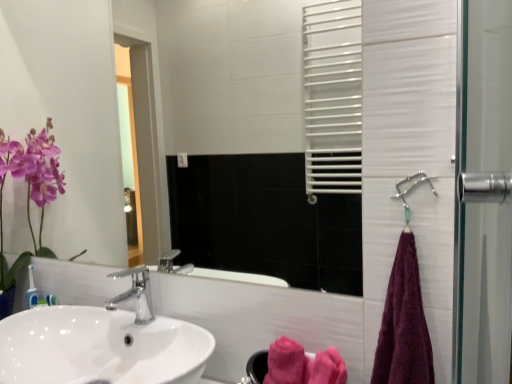
Question: From a real-world perspective, is pink fluffy bath towel at lower center, positioned as the second bath towel in right-to-left order, physically above metallic silver shower at right?

Choices:
 (A) no
 (B) yes

Answer: (A)

Question: From a real-world perspective, is pink fluffy bath towel at lower center, the 1th bath towel when ordered from back to front, beneath metallic silver shower at right?

Choices:
 (A) yes
 (B) no

Answer: (A)

Question: Would you consider pink fluffy bath towel at lower center, the 1th bath towel when ordered from back to front, to be distant from metallic silver shower at right?

Choices:
 (A) no
 (B) yes

Answer: (A)

Question: Is pink fluffy bath towel at lower center, positioned as the 2th bath towel in front-to-back order, turned away from metallic silver shower at right?

Choices:
 (A) no
 (B) yes

Answer: (A)

Question: Is pink fluffy bath towel at lower center, which is the first bath towel in left-to-right order, outside of metallic silver shower at right?

Choices:
 (A) no
 (B) yes

Answer: (B)

Question: Does pink fluffy bath towel at lower center, which is the first bath towel in left-to-right order, have a smaller size compared to metallic silver shower at right?

Choices:
 (A) no
 (B) yes

Answer: (A)

Question: Does polished chrome faucet at center have a greater width compared to purple cotton towel at right, placed as the 1th bath towel when sorted from front to back?

Choices:
 (A) no
 (B) yes

Answer: (B)

Question: Is the surface of polished chrome faucet at center in direct contact with purple cotton towel at right, which appears as the first bath towel when viewed from the right?

Choices:
 (A) no
 (B) yes

Answer: (A)

Question: From the image's perspective, is polished chrome faucet at center below purple cotton towel at right, placed as the 1th bath towel when sorted from front to back?

Choices:
 (A) yes
 (B) no

Answer: (A)

Question: Is polished chrome faucet at center closer to the viewer compared to purple cotton towel at right, which is counted as the second bath towel, starting from the left?

Choices:
 (A) no
 (B) yes

Answer: (A)

Question: Is purple cotton towel at right, which appears as the first bath towel when viewed from the right, at the back of polished chrome faucet at center?

Choices:
 (A) yes
 (B) no

Answer: (B)

Question: Is polished chrome faucet at center thinner than purple cotton towel at right, placed as the 1th bath towel when sorted from front to back?

Choices:
 (A) yes
 (B) no

Answer: (B)

Question: Considering the relative sizes of polished chrome faucet at center and white glossy sink at lower left in the image provided, is polished chrome faucet at center smaller than white glossy sink at lower left?

Choices:
 (A) yes
 (B) no

Answer: (A)